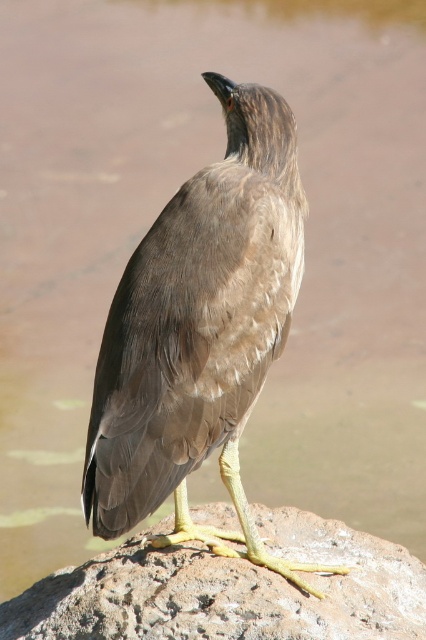
Which of these two, brown feathered bird at center or rocky surface at center, stands taller?

brown feathered bird at center is taller.

Can you confirm if brown feathered bird at center is positioned below rocky surface at center?

No.

Is point (155, 280) positioned before point (97, 625)?

Yes.

Find the location of a particular element. This screenshot has height=640, width=426. brown feathered bird at center is located at coordinates (199, 332).